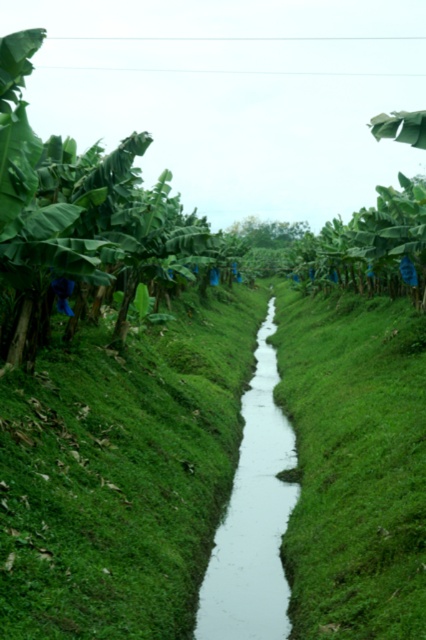
Question: From the image, what is the correct spatial relationship of green leafy banana tree at left in relation to white smooth stream at center?

Choices:
 (A) left
 (B) right

Answer: (A)

Question: Estimate the real-world distances between objects in this image. Which object is closer to the green grass at center?

Choices:
 (A) white smooth stream at center
 (B) green leafy banana tree at left

Answer: (A)

Question: Does green leafy banana tree at left appear under white smooth stream at center?

Choices:
 (A) yes
 (B) no

Answer: (B)

Question: Estimate the real-world distances between objects in this image. Which object is farther from the white smooth stream at center?

Choices:
 (A) green grass at center
 (B) green leafy banana tree at left

Answer: (B)

Question: Can you confirm if green leafy banana tree at left is wider than white smooth stream at center?

Choices:
 (A) no
 (B) yes

Answer: (B)

Question: Estimate the real-world distances between objects in this image. Which object is farther from the green leafy banana tree at left?

Choices:
 (A) green grass at center
 (B) white smooth stream at center

Answer: (B)